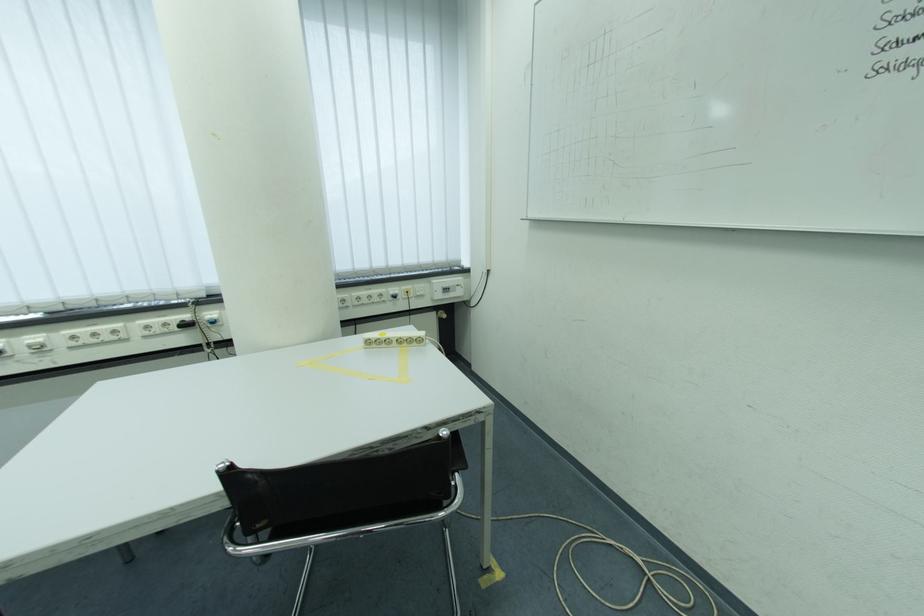
Find where to push the blue power switch. Please return your answer as a coordinate pair (x, y).

(212, 318)